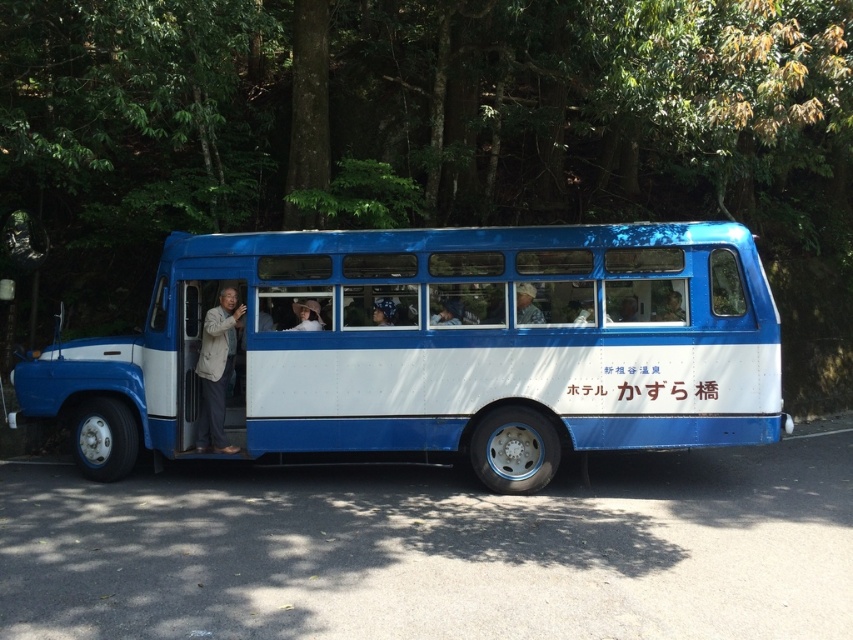
Is blue matte bus at center taller than beige fabric jacket at left?

No.

Describe the element at coordinates (437, 348) in the screenshot. Image resolution: width=853 pixels, height=640 pixels. I see `blue matte bus at center` at that location.

Identify the location of blue matte bus at center. The width and height of the screenshot is (853, 640). coord(437,348).